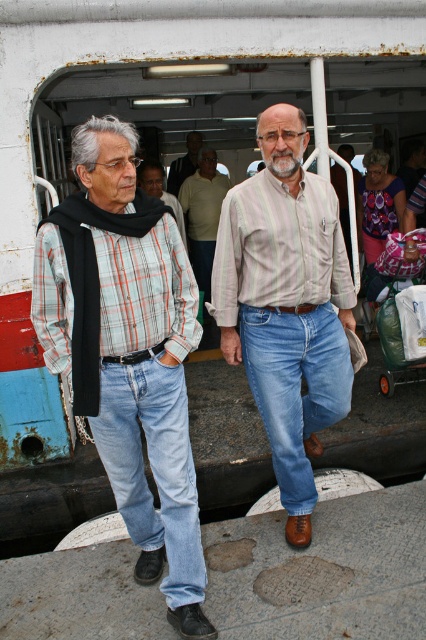
Question: Is striped cotton shirt at center to the left of blue denim jeans at center from the viewer's perspective?

Choices:
 (A) no
 (B) yes

Answer: (B)

Question: Can you confirm if light beige sweater at center is smaller than plaid shirt at center?

Choices:
 (A) yes
 (B) no

Answer: (B)

Question: Which of the following is the farthest from the observer?

Choices:
 (A) striped cotton shirt at center
 (B) light brown shirt at center
 (C) plaid cotton shirt at left

Answer: (B)

Question: Estimate the real-world distances between objects in this image. Which object is farther from the plaid shirt at center?

Choices:
 (A) striped cotton shirt at center
 (B) light beige sweater at center

Answer: (A)

Question: Which object is positioned farthest from the plaid cotton shirt at left?

Choices:
 (A) blue denim jeans at center
 (B) blue denim jeans at left

Answer: (A)

Question: Is plaid cotton shirt at left above blue denim jeans at left?

Choices:
 (A) no
 (B) yes

Answer: (B)